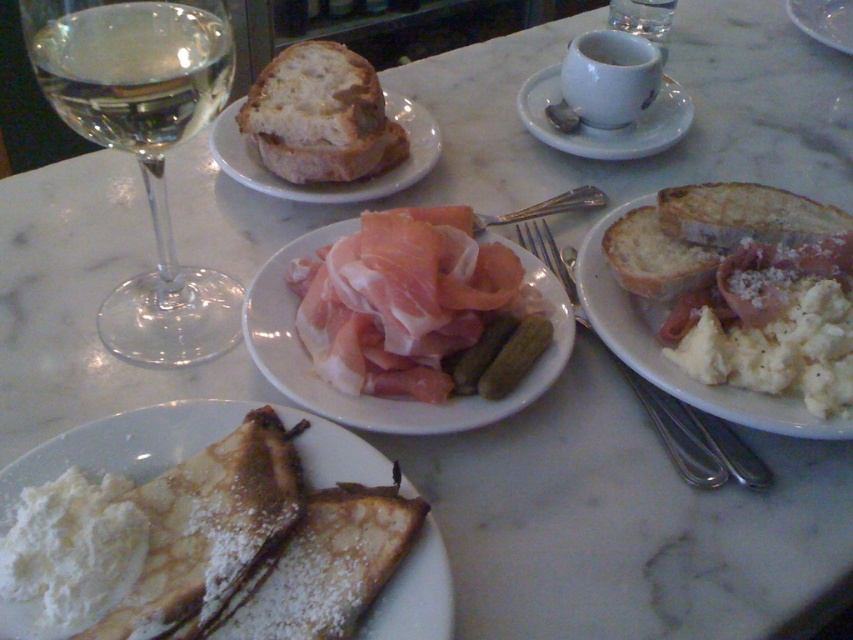
Can you confirm if white bread at center is positioned to the right of white matte plate at upper center?

In fact, white bread at center is to the left of white matte plate at upper center.

Can you confirm if white bread at center is bigger than white matte plate at upper center?

Indeed, white bread at center has a larger size compared to white matte plate at upper center.

Between point (228, 125) and point (846, 32), which one is positioned in front?

Point (228, 125) is more forward.

The height and width of the screenshot is (640, 853). In order to click on white bread at center in this screenshot , I will do click(x=329, y=180).

Does point (115, 115) lie in front of point (527, 115)?

That is True.

Does clear glass wine at upper left appear over white ceramic cup at upper center?

No.

What do you see at coordinates (131, 67) in the screenshot? The height and width of the screenshot is (640, 853). I see `clear glass wine at upper left` at bounding box center [131, 67].

Find the location of a particular element. This screenshot has height=640, width=853. clear glass wine at upper left is located at coordinates (131, 67).

Does white creamy mashed potatoes at center lie in front of white ceramic cup at upper center?

Yes, white creamy mashed potatoes at center is in front of white ceramic cup at upper center.

Is white creamy mashed potatoes at center to the right of white ceramic cup at upper center from the viewer's perspective?

Incorrect, white creamy mashed potatoes at center is not on the right side of white ceramic cup at upper center.

Image resolution: width=853 pixels, height=640 pixels. Describe the element at coordinates (671, 360) in the screenshot. I see `white creamy mashed potatoes at center` at that location.

The image size is (853, 640). Identify the location of white creamy mashed potatoes at center. (671, 360).